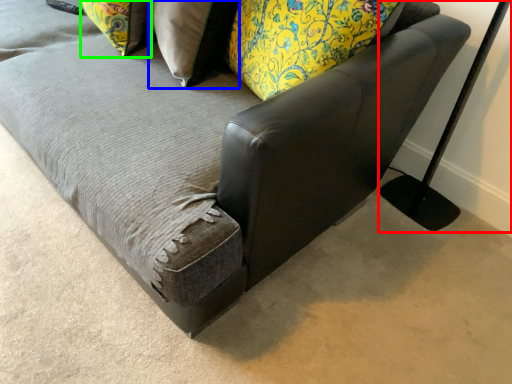
Question: Which is nearer to the table lamp (highlighted by a red box)? pillow (highlighted by a blue box) or pillow (highlighted by a green box).

Choices:
 (A) pillow
 (B) pillow

Answer: (A)